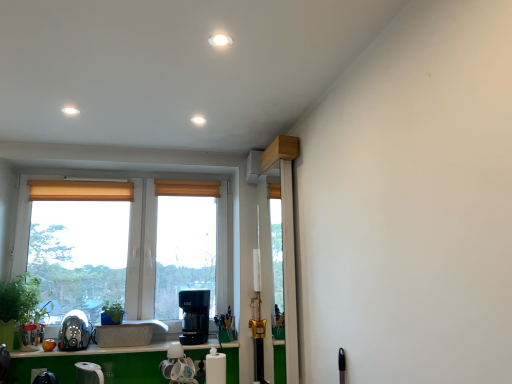
What do you see at coordinates (187, 188) in the screenshot? Image resolution: width=512 pixels, height=384 pixels. I see `orange fabric curtain at center, the 2th curtain in the left-to-right sequence` at bounding box center [187, 188].

Describe the element at coordinates (97, 351) in the screenshot. This screenshot has height=384, width=512. I see `white glossy countertop at lower center` at that location.

Measure the distance between point (65, 346) and camera.

Point (65, 346) is 2.48 meters from camera.

The image size is (512, 384). What do you see at coordinates (21, 300) in the screenshot?
I see `green matte plant at left, the first plant viewed from the left` at bounding box center [21, 300].

How much space does green matte plant at center, which ranks as the first plant in right-to-left order, occupy horizontally?

green matte plant at center, which ranks as the first plant in right-to-left order, is 7.43 inches in width.

The width and height of the screenshot is (512, 384). Describe the element at coordinates (112, 313) in the screenshot. I see `green matte plant at center, which ranks as the first plant in right-to-left order` at that location.

I want to click on matte yellow curtain at left, the first curtain when ordered from left to right, so click(80, 190).

Is the depth of white glossy coffee maker at lower center, the 1th appliance from the left, less than that of clear plastic screen door at center?

No, white glossy coffee maker at lower center, the 1th appliance from the left, is further to the viewer.

Which point is more distant from viewer, (163, 363) or (292, 142)?

The point (163, 363) is farther.

Is white glossy coffee maker at lower center, which is the 2th appliance in right-to-left order, next to clear plastic screen door at center and touching it?

No, white glossy coffee maker at lower center, which is the 2th appliance in right-to-left order, is not making contact with clear plastic screen door at center.

Is green matte plant at center, which ranks as the first plant in right-to-left order, not near satin silver coffee machine at lower left, positioned as the first coffee machine in left-to-right order?

green matte plant at center, which ranks as the first plant in right-to-left order, is actually quite close to satin silver coffee machine at lower left, positioned as the first coffee machine in left-to-right order.

From a real-world perspective, which is physically below, green matte plant at center, which ranks as the first plant in right-to-left order, or satin silver coffee machine at lower left, which appears as the second coffee machine when viewed from the right?

satin silver coffee machine at lower left, which appears as the second coffee machine when viewed from the right.

How different are the orientations of green matte plant at center, positioned as the second plant in left-to-right order, and satin silver coffee machine at lower left, positioned as the first coffee machine in left-to-right order, in degrees?

They differ by 0.00152 degrees in their facing directions.

Measure the distance between green matte plant at center, which ranks as the first plant in right-to-left order, and satin silver coffee machine at lower left, which appears as the second coffee machine when viewed from the right.

They are 6.59 inches apart.

Locate an element on the screen. screen door on the right of the satin silver coffee machine at lower left, which appears as the second coffee machine when viewed from the right is located at coordinates (285, 238).

Looking at this image, between satin silver coffee machine at lower left, positioned as the first coffee machine in left-to-right order, and clear plastic screen door at center, which one has smaller width?

Thinner between the two is clear plastic screen door at center.

From a real-world perspective, is satin silver coffee machine at lower left, positioned as the first coffee machine in left-to-right order, positioned above or below clear plastic screen door at center?

From a real-world perspective, satin silver coffee machine at lower left, positioned as the first coffee machine in left-to-right order, is physically below clear plastic screen door at center.

From the picture: Is satin silver coffee machine at lower left, positioned as the first coffee machine in left-to-right order, facing away from clear plastic screen door at center?

satin silver coffee machine at lower left, positioned as the first coffee machine in left-to-right order, does not have its back to clear plastic screen door at center.

Is black plastic coffee machine at lower center, which is counted as the 1th coffee machine, starting from the right, aimed at white matte sink at lower center?

No, black plastic coffee machine at lower center, which is counted as the 1th coffee machine, starting from the right, is not turned towards white matte sink at lower center.

Does black plastic coffee machine at lower center, which is counted as the 1th coffee machine, starting from the right, contain white matte sink at lower center?

No, white matte sink at lower center is not inside black plastic coffee machine at lower center, which is counted as the 1th coffee machine, starting from the right.

In the scene shown: Which is behind, black plastic coffee machine at lower center, which is counted as the 1th coffee machine, starting from the right, or white matte sink at lower center?

black plastic coffee machine at lower center, which is counted as the 1th coffee machine, starting from the right.

Considering the positions of point (191, 292) and point (165, 325), is point (191, 292) closer or farther from the camera than point (165, 325)?

Point (191, 292).

Looking at the image, does satin silver coffee machine at lower left, which appears as the second coffee machine when viewed from the right, seem bigger or smaller compared to green matte plant at center, which ranks as the first plant in right-to-left order?

Considering their sizes, satin silver coffee machine at lower left, which appears as the second coffee machine when viewed from the right, takes up more space than green matte plant at center, which ranks as the first plant in right-to-left order.

Can we say satin silver coffee machine at lower left, which appears as the second coffee machine when viewed from the right, lies outside green matte plant at center, positioned as the second plant in left-to-right order?

satin silver coffee machine at lower left, which appears as the second coffee machine when viewed from the right, lies outside green matte plant at center, positioned as the second plant in left-to-right order,'s area.

Are satin silver coffee machine at lower left, positioned as the first coffee machine in left-to-right order, and green matte plant at center, which ranks as the first plant in right-to-left order, far apart?

No, there isn't a large distance between satin silver coffee machine at lower left, positioned as the first coffee machine in left-to-right order, and green matte plant at center, which ranks as the first plant in right-to-left order.

Considering the relative positions of satin silver coffee machine at lower left, positioned as the first coffee machine in left-to-right order, and green matte plant at center, positioned as the second plant in left-to-right order, in the image provided, is satin silver coffee machine at lower left, positioned as the first coffee machine in left-to-right order, to the right of green matte plant at center, positioned as the second plant in left-to-right order, from the viewer's perspective?

No.

Who is shorter, white glossy coffee maker at lower center, the 1th appliance from the left, or green matte plant at center, which ranks as the first plant in right-to-left order?

Standing shorter between the two is green matte plant at center, which ranks as the first plant in right-to-left order.

In terms of width, does white glossy coffee maker at lower center, which is the 2th appliance in right-to-left order, look wider or thinner when compared to green matte plant at center, positioned as the second plant in left-to-right order?

In the image, white glossy coffee maker at lower center, which is the 2th appliance in right-to-left order, appears to be more narrow than green matte plant at center, positioned as the second plant in left-to-right order.

Would you say white glossy coffee maker at lower center, which is the 2th appliance in right-to-left order, is to the left or to the right of green matte plant at center, positioned as the second plant in left-to-right order, in the picture?

Clearly, white glossy coffee maker at lower center, which is the 2th appliance in right-to-left order, is on the right of green matte plant at center, positioned as the second plant in left-to-right order, in the image.

Would you say white glossy coffee maker at lower center, which is the 2th appliance in right-to-left order, contains green matte plant at center, which ranks as the first plant in right-to-left order?

No, green matte plant at center, which ranks as the first plant in right-to-left order, is not surrounded by white glossy coffee maker at lower center, which is the 2th appliance in right-to-left order.

From the image's perspective, is orange fabric curtain at center, which appears as the 1th curtain when viewed from the right, located above or below black plastic coffee machine at lower center, which is counted as the 1th coffee machine, starting from the right?

orange fabric curtain at center, which appears as the 1th curtain when viewed from the right, is above black plastic coffee machine at lower center, which is counted as the 1th coffee machine, starting from the right.

Is point (199, 189) behind point (198, 335)?

That is True.

In the image, is orange fabric curtain at center, which appears as the 1th curtain when viewed from the right, on the left side or the right side of black plastic coffee machine at lower center, which is counted as the 1th coffee machine, starting from the right?

In the image, orange fabric curtain at center, which appears as the 1th curtain when viewed from the right, appears on the left side of black plastic coffee machine at lower center, which is counted as the 1th coffee machine, starting from the right.

Where is `screen door on the right of white glossy coffee maker at lower center, the 1th appliance from the left`? The height and width of the screenshot is (384, 512). screen door on the right of white glossy coffee maker at lower center, the 1th appliance from the left is located at coordinates (285, 238).

Identify the location of plant behind the satin silver coffee machine at lower left, which appears as the second coffee machine when viewed from the right. This screenshot has width=512, height=384. (112, 313).

When comparing their distances from matte yellow curtain at left, arranged as the second curtain when viewed from the right, does white glossy paper towel holder at center, which appears as the first appliance when viewed from the right, or white glossy coffee maker at lower center, the 1th appliance from the left, seem closer?

white glossy coffee maker at lower center, the 1th appliance from the left, lies closer to matte yellow curtain at left, arranged as the second curtain when viewed from the right, than the other object.

Estimate the real-world distances between objects in this image. Which object is closer to green matte plant at left, the first plant viewed from the left, white matte sink at lower center or white glossy paper towel holder at center, positioned as the 2th appliance in left-to-right order?

white matte sink at lower center is closer to green matte plant at left, the first plant viewed from the left.

From the image, which object appears to be nearer to green matte plant at left, the first plant viewed from the left, matte yellow curtain at left, arranged as the second curtain when viewed from the right, or white glossy coffee maker at lower center, the 1th appliance from the left?

matte yellow curtain at left, arranged as the second curtain when viewed from the right.

From the image, which object appears to be farther from white glossy countertop at lower center, green matte plant at center, positioned as the second plant in left-to-right order, or matte yellow curtain at left, arranged as the second curtain when viewed from the right?

Based on the image, matte yellow curtain at left, arranged as the second curtain when viewed from the right, appears to be further to white glossy countertop at lower center.

Based on the photo, when comparing their distances from clear plastic screen door at center, does green matte plant at left, the second plant viewed from the right, or white glossy paper towel holder at center, which appears as the first appliance when viewed from the right, seem closer?

white glossy paper towel holder at center, which appears as the first appliance when viewed from the right, lies closer to clear plastic screen door at center than the other object.

Considering their positions, is white glossy coffee maker at lower center, which is the 2th appliance in right-to-left order, positioned closer to orange fabric curtain at center, which appears as the 1th curtain when viewed from the right, than green matte plant at center, positioned as the second plant in left-to-right order?

Among the two, green matte plant at center, positioned as the second plant in left-to-right order, is located nearer to orange fabric curtain at center, which appears as the 1th curtain when viewed from the right.

Based on their spatial positions, is white glossy coffee maker at lower center, which is the 2th appliance in right-to-left order, or green matte plant at left, the first plant viewed from the left, further from clear plastic screen door at center?

Among the two, green matte plant at left, the first plant viewed from the left, is located further to clear plastic screen door at center.

Which object lies further to the anchor point white glossy countertop at lower center, satin silver coffee machine at lower left, positioned as the first coffee machine in left-to-right order, or white glossy coffee maker at lower center, the 1th appliance from the left?

satin silver coffee machine at lower left, positioned as the first coffee machine in left-to-right order.

The width and height of the screenshot is (512, 384). Identify the location of counter top situated between satin silver coffee machine at lower left, positioned as the first coffee machine in left-to-right order, and black plastic coffee machine at lower center, which is counted as the 1th coffee machine, starting from the right, from left to right. (97, 351).

This screenshot has width=512, height=384. Find the location of `coffee machine situated between white glossy countertop at lower center and clear plastic screen door at center from left to right`. coffee machine situated between white glossy countertop at lower center and clear plastic screen door at center from left to right is located at coordinates pyautogui.click(x=194, y=316).

Where is `coffee machine between white matte sink at lower center and white glossy paper towel holder at center, positioned as the 2th appliance in left-to-right order, in the horizontal direction`? The image size is (512, 384). coffee machine between white matte sink at lower center and white glossy paper towel holder at center, positioned as the 2th appliance in left-to-right order, in the horizontal direction is located at coordinates (194, 316).

In order to click on coffee machine between green matte plant at left, the second plant viewed from the right, and black plastic coffee machine at lower center, positioned as the second coffee machine in left-to-right order, in the horizontal direction in this screenshot , I will do (74, 331).